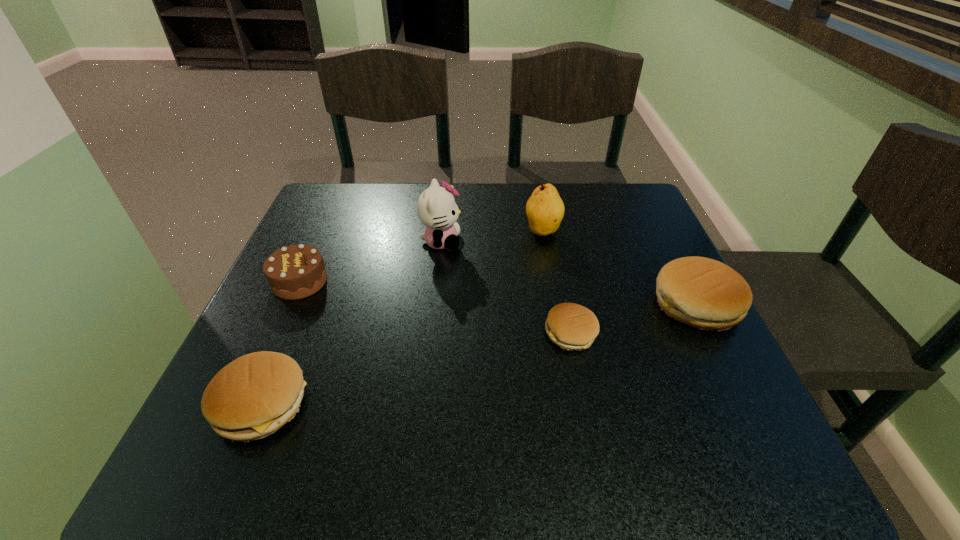
This screenshot has height=540, width=960. In order to click on object that is positioned at the right edge in this screenshot , I will do `click(704, 293)`.

Image resolution: width=960 pixels, height=540 pixels. I want to click on object present at the near left corner, so click(x=253, y=396).

In the image, there is a desktop. At what (x,y) coordinates should I click in order to perform the action: click on vacant space at the far edge. Please return your answer as a coordinate pair (x, y). The height and width of the screenshot is (540, 960). Looking at the image, I should click on (440, 183).

The image size is (960, 540). I want to click on free space at the near edge, so click(x=514, y=410).

This screenshot has width=960, height=540. Find the location of `vacant area at the left edge`. vacant area at the left edge is located at coordinates (300, 365).

Image resolution: width=960 pixels, height=540 pixels. I want to click on vacant space at the right edge of the desktop, so click(x=605, y=240).

In the image, there is a desktop. Where is `vacant space at the far left corner`? vacant space at the far left corner is located at coordinates (346, 199).

At what (x,y) coordinates should I click in order to perform the action: click on vacant space at the far right corner. Please return your answer as a coordinate pair (x, y). This screenshot has height=540, width=960. Looking at the image, I should click on (600, 202).

What are the coordinates of `free space between the rightmost object and the nearest object` in the screenshot? It's located at (479, 354).

This screenshot has width=960, height=540. I want to click on free point between the chocolate cake and the pear, so click(x=421, y=256).